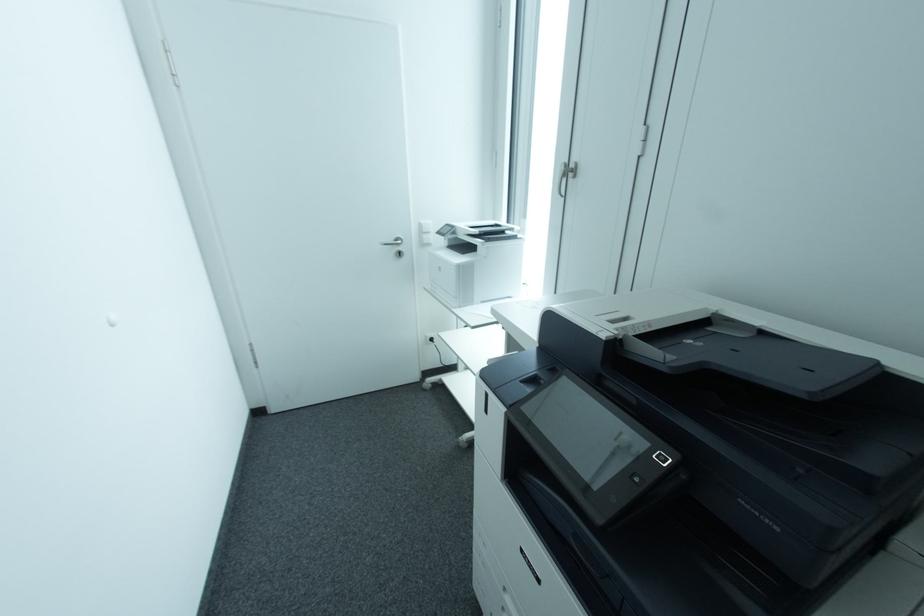
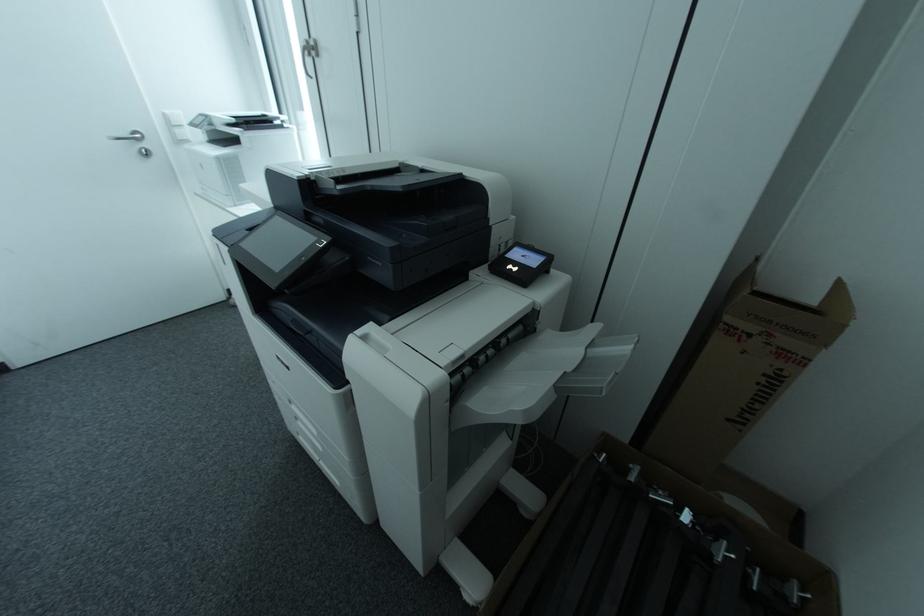
Which direction would the cameraman need to move to produce the second image?

The cameraman moved toward right, backward.